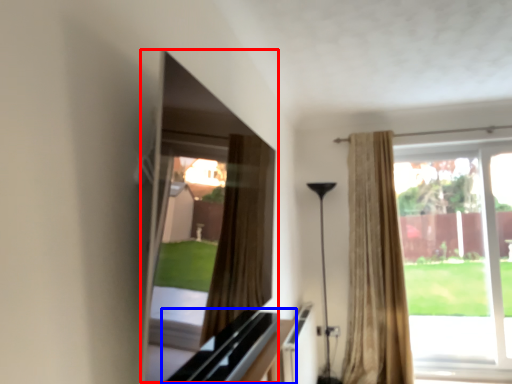
Question: Which point is further to the camera, window screen (highlighted by a red box) or dresser (highlighted by a blue box)?

Choices:
 (A) window screen
 (B) dresser

Answer: (B)